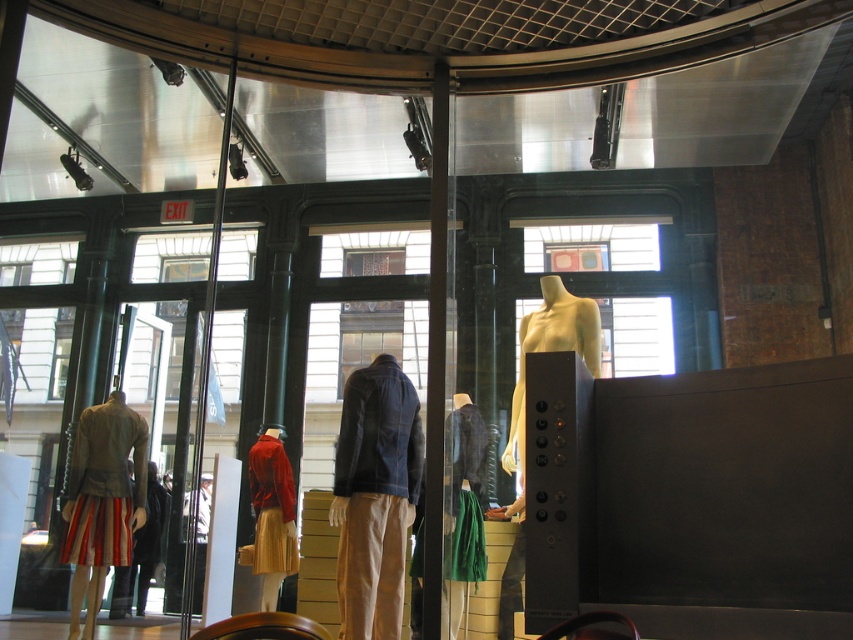
Identify the location of denim jacket at center. (374, 497).

Locate an element on the screen. This screenshot has height=640, width=853. denim jacket at center is located at coordinates (374, 497).

Can you confirm if green fabric skirt at center is positioned to the right of matte yellow mannequin at center?

In fact, green fabric skirt at center is to the left of matte yellow mannequin at center.

Who is more distant from viewer, (x=486, y=429) or (x=512, y=513)?

The point (x=486, y=429) is behind.

This screenshot has height=640, width=853. What do you see at coordinates (462, 508) in the screenshot?
I see `green fabric skirt at center` at bounding box center [462, 508].

Locate an element on the screen. The image size is (853, 640). green fabric skirt at center is located at coordinates pos(462,508).

Is shiny red jacket at center bigger than leather jacket at lower left?

Yes, shiny red jacket at center is bigger than leather jacket at lower left.

Is shiny red jacket at center thinner than leather jacket at lower left?

In fact, shiny red jacket at center might be wider than leather jacket at lower left.

Which is in front, point (283, 564) or point (138, 605)?

Point (283, 564) is in front.

The width and height of the screenshot is (853, 640). In order to click on shiny red jacket at center in this screenshot , I will do `click(271, 515)`.